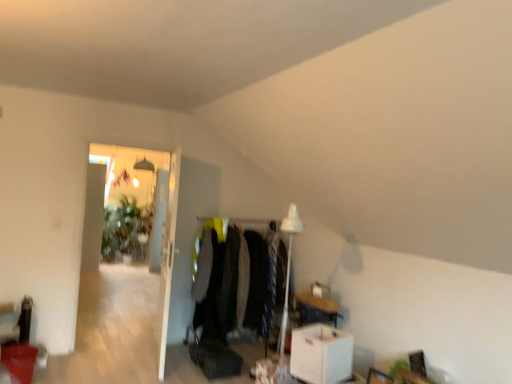
Identify the location of vacant space positioned to the left of white glossy door at upper left. (124, 357).